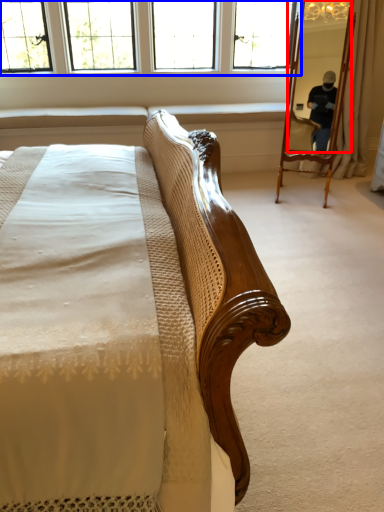
Question: Which point is further to the camera, mirror (highlighted by a red box) or window (highlighted by a blue box)?

Choices:
 (A) mirror
 (B) window

Answer: (B)